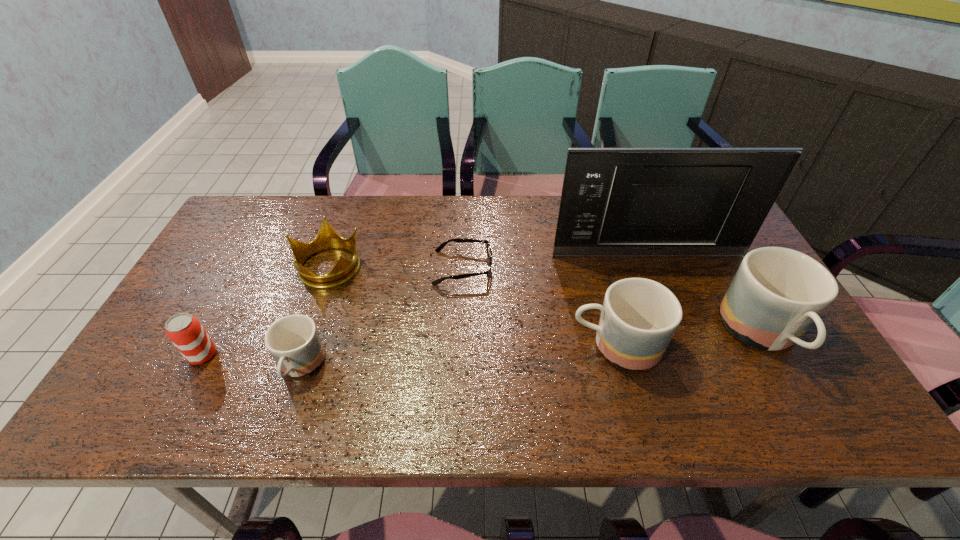
Please point a space for a new mug to maintain equal intervals. Please provide its 2D coordinates. Your answer should be formatted as a tuple, i.e. [(x, y)], where the tuple contains the x and y coordinates of a point satisfying the conditions above.

[(461, 356)]